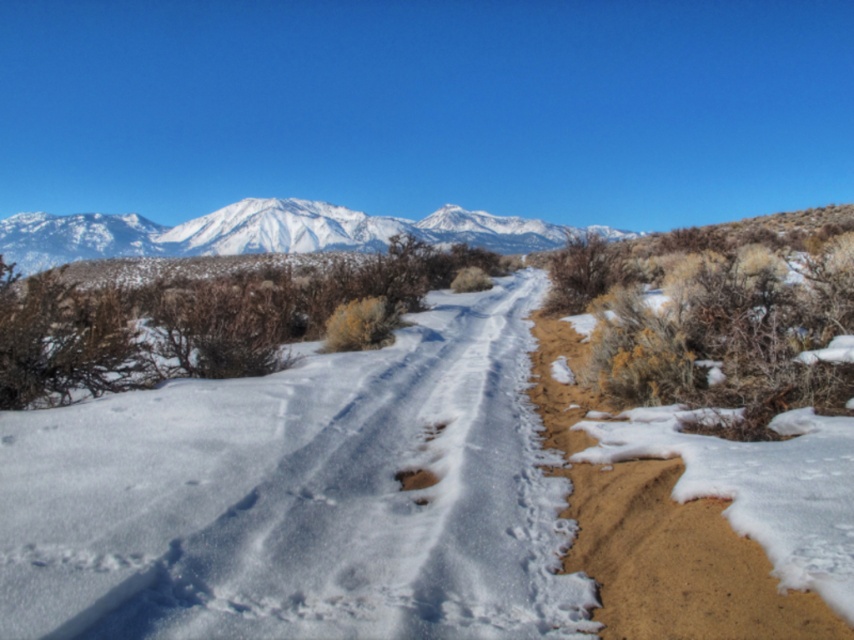
You are a hiker planning to take a photo of the snowy white mountain range at upper center and the brown dirt footprint at center. Which object should you focus on first if you want both to be in sharp focus?

The brown dirt footprint at center should be focused on first because it is closer to the camera than the snowy white mountain range at upper center, ensuring both will be in focus when using depth of field properly.

You are an outdoor photographer planning to capture the snowy white mountain range at upper center and the brown dirt footprint at center in a single shot. Which object will appear larger in the photo?

The snowy white mountain range at upper center will appear larger in the photo because it is bigger than the brown dirt footprint at center.

You are a hiker trying to locate the brown sandy dirt track at right in the winter landscape. According to the map, the track is marked at coordinates 0.878, 0.794. Where should you look to find it?

The brown sandy dirt track at right is located at the 2D coordinates [677,559], so you should look towards the lower right portion of the image where the track is positioned.